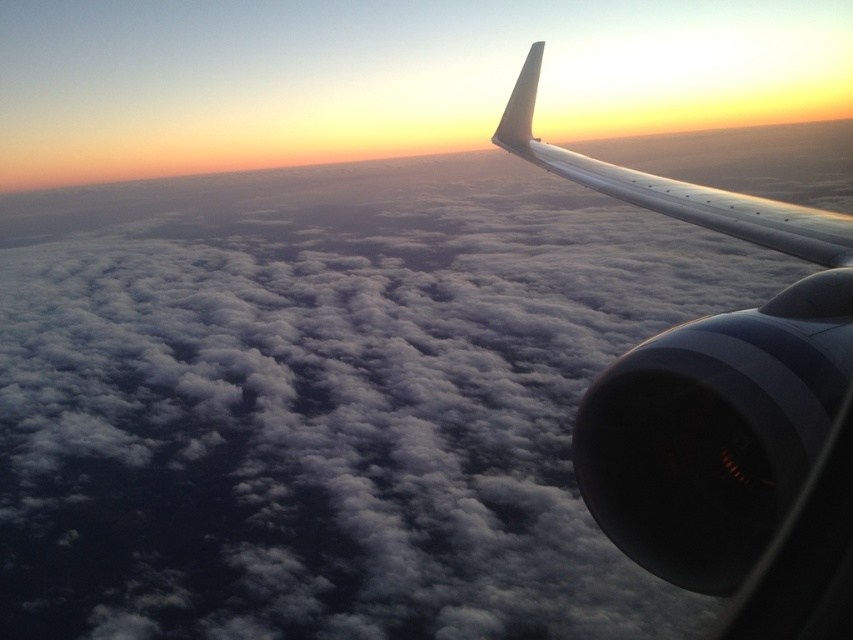
Is metallic gray wing at upper right bigger than sleek metallic wing at upper right?

No, metallic gray wing at upper right is not bigger than sleek metallic wing at upper right.

Is metallic gray wing at upper right further to the viewer compared to sleek metallic wing at upper right?

No, metallic gray wing at upper right is in front of sleek metallic wing at upper right.

Between point (531, 86) and point (744, 221), which one is positioned in front?

Point (744, 221) is in front.

The image size is (853, 640). I want to click on metallic gray wing at upper right, so click(706, 380).